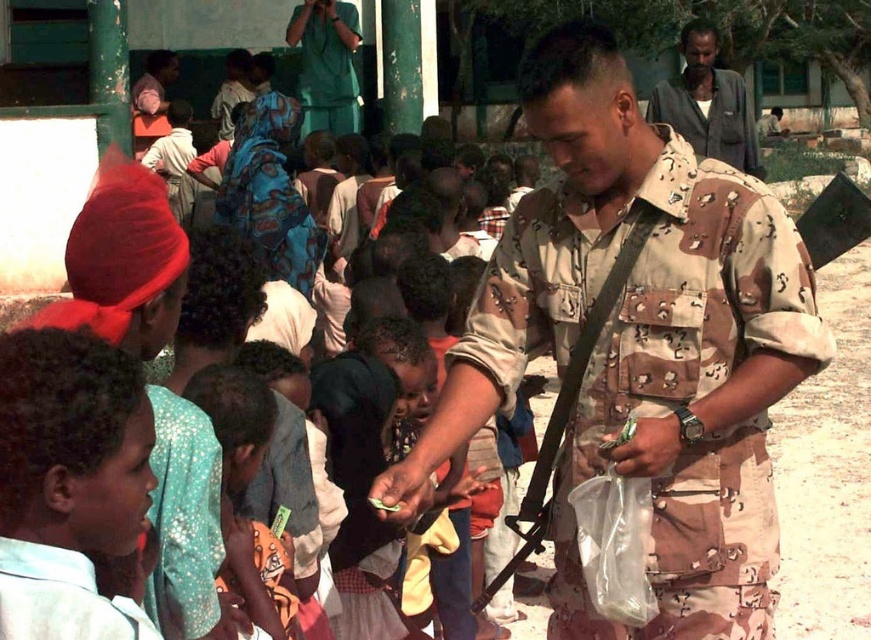
Question: Estimate the real-world distances between objects in this image. Which object is farther from the camouflage uniform at center?

Choices:
 (A) green uniform at upper center
 (B) light blue shirt at lower left
 (C) orange fabric dress at center

Answer: (A)

Question: Can you confirm if dark gray shirt at upper right is positioned to the right of green uniform at upper center?

Choices:
 (A) yes
 (B) no

Answer: (A)

Question: Which of these objects is positioned closest to the light blue fabric shirt at lower left?

Choices:
 (A) light blue shirt at lower left
 (B) green uniform at upper center
 (C) camouflage uniform at center
 (D) dark gray shirt at upper right

Answer: (A)

Question: Can you confirm if light blue shirt at lower left is positioned to the right of orange fabric dress at center?

Choices:
 (A) yes
 (B) no

Answer: (B)

Question: Can you confirm if orange fabric dress at center is bigger than dark gray shirt at upper right?

Choices:
 (A) no
 (B) yes

Answer: (A)

Question: Which object is closer to the camera taking this photo?

Choices:
 (A) light blue fabric shirt at lower left
 (B) orange fabric dress at center
 (C) light blue shirt at lower left
 (D) green uniform at upper center

Answer: (A)